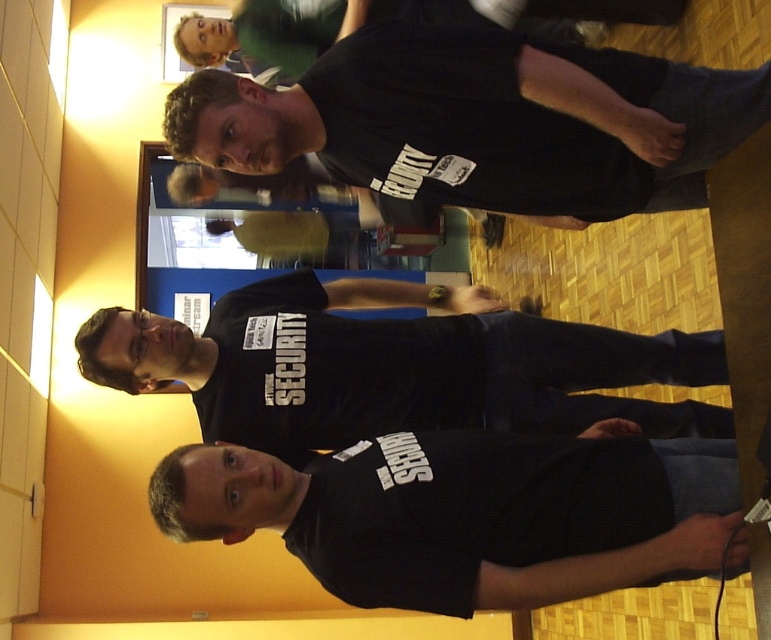
Question: Can you confirm if black matte shirt at lower center is smaller than black matte security shirt at center?

Choices:
 (A) no
 (B) yes

Answer: (B)

Question: Is black matte shirt at lower center above black matte security shirt at center?

Choices:
 (A) yes
 (B) no

Answer: (B)

Question: Which is farther from the black cotton t-shirt at upper center?

Choices:
 (A) matte black security guard at upper center
 (B) black matte shirt at lower center
 (C) black matte security shirt at center

Answer: (A)

Question: In this image, where is black matte shirt at lower center located relative to matte black security guard at upper center?

Choices:
 (A) above
 (B) below

Answer: (B)

Question: Among these objects, which one is nearest to the camera?

Choices:
 (A) matte black security guard at upper center
 (B) black matte security shirt at center
 (C) black matte shirt at lower center
 (D) black cotton t-shirt at upper center

Answer: (C)

Question: Which object is closer to the camera taking this photo?

Choices:
 (A) black matte shirt at lower center
 (B) matte black security guard at upper center

Answer: (A)